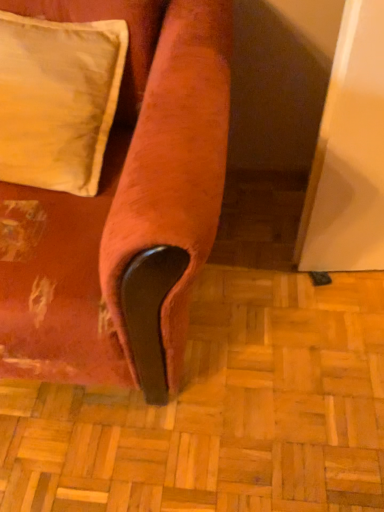
Describe the element at coordinates (58, 100) in the screenshot. The image size is (384, 512). I see `satin cream pillow at upper left` at that location.

Locate an element on the screen. satin cream pillow at upper left is located at coordinates (58, 100).

Based on the photo, in order to face satin cream pillow at upper left, should I rotate leftwards or rightwards?

Turn left approximately 20.780 degrees to face it.

What do you see at coordinates (124, 210) in the screenshot? This screenshot has width=384, height=512. I see `velvet-like orange couch at lower left` at bounding box center [124, 210].

I want to click on velvet-like orange couch at lower left, so click(124, 210).

What is the approximate width of velvet-like orange couch at lower left?

The width of velvet-like orange couch at lower left is 96.36 centimeters.

Find the location of a particular element. satin cream pillow at upper left is located at coordinates (58, 100).

Can you confirm if velvet-like orange couch at lower left is positioned to the left of satin cream pillow at upper left?

Indeed, velvet-like orange couch at lower left is positioned on the left side of satin cream pillow at upper left.

Which object is closer to the camera taking this photo, velvet-like orange couch at lower left or satin cream pillow at upper left?

velvet-like orange couch at lower left.

Which is in front, point (215, 200) or point (10, 47)?

The point (215, 200) is in front.

From the image's perspective, between velvet-like orange couch at lower left and satin cream pillow at upper left, which one is located above?

satin cream pillow at upper left.

From a real-world perspective, is velvet-like orange couch at lower left positioned under satin cream pillow at upper left based on gravity?

Indeed, from a real-world perspective, velvet-like orange couch at lower left is positioned beneath satin cream pillow at upper left.

Which of these two, velvet-like orange couch at lower left or satin cream pillow at upper left, is thinner?

Thinner between the two is satin cream pillow at upper left.

Considering the relative sizes of velvet-like orange couch at lower left and satin cream pillow at upper left in the image provided, is velvet-like orange couch at lower left taller than satin cream pillow at upper left?

Indeed, velvet-like orange couch at lower left has a greater height compared to satin cream pillow at upper left.

Does velvet-like orange couch at lower left have a larger size compared to satin cream pillow at upper left?

Indeed, velvet-like orange couch at lower left has a larger size compared to satin cream pillow at upper left.

Is velvet-like orange couch at lower left not inside satin cream pillow at upper left?

velvet-like orange couch at lower left lies outside satin cream pillow at upper left's area.

Are velvet-like orange couch at lower left and satin cream pillow at upper left beside each other?

No, velvet-like orange couch at lower left is not making contact with satin cream pillow at upper left.

Is velvet-like orange couch at lower left aimed at satin cream pillow at upper left?

Yes, velvet-like orange couch at lower left is aimed at satin cream pillow at upper left.

You are a GUI agent. You are given a task and a screenshot of the screen. Output one action in this format:
    pyautogui.click(x=<x>, y=<y>)
    Task: Click on the pillow on the right of velvet-like orange couch at lower left
    
    Given the screenshot: What is the action you would take?
    pyautogui.click(x=58, y=100)

Which is more to the right, satin cream pillow at upper left or velvet-like orange couch at lower left?

From the viewer's perspective, satin cream pillow at upper left appears more on the right side.

Considering the relative positions of satin cream pillow at upper left and velvet-like orange couch at lower left in the image provided, is satin cream pillow at upper left in front of velvet-like orange couch at lower left?

No, the depth of satin cream pillow at upper left is greater than that of velvet-like orange couch at lower left.

Which is further, (93, 104) or (154, 170)?

The point (93, 104) is more distant.

From the image's perspective, which one is positioned higher, satin cream pillow at upper left or velvet-like orange couch at lower left?

satin cream pillow at upper left.

From a real-world perspective, which object rests below the other?

velvet-like orange couch at lower left.

Is satin cream pillow at upper left wider or thinner than velvet-like orange couch at lower left?

Considering their sizes, satin cream pillow at upper left looks slimmer than velvet-like orange couch at lower left.

Does satin cream pillow at upper left have a lesser height compared to velvet-like orange couch at lower left?

Yes.

Can you confirm if satin cream pillow at upper left is smaller than velvet-like orange couch at lower left?

Yes, satin cream pillow at upper left is smaller than velvet-like orange couch at lower left.

Does satin cream pillow at upper left contain velvet-like orange couch at lower left?

No, satin cream pillow at upper left does not contain velvet-like orange couch at lower left.

Is satin cream pillow at upper left not close to velvet-like orange couch at lower left?

Result: No, satin cream pillow at upper left is in close proximity to velvet-like orange couch at lower left.

Is satin cream pillow at upper left oriented away from velvet-like orange couch at lower left?

Yes, satin cream pillow at upper left is positioned with its back facing velvet-like orange couch at lower left.

Where is `furniture in front of the satin cream pillow at upper left`? Image resolution: width=384 pixels, height=512 pixels. furniture in front of the satin cream pillow at upper left is located at coordinates (124, 210).

Find the location of a particular element. pillow above the velvet-like orange couch at lower left (from a real-world perspective) is located at coordinates (58, 100).

This screenshot has width=384, height=512. Identify the location of furniture lying below the satin cream pillow at upper left (from the image's perspective). (124, 210).